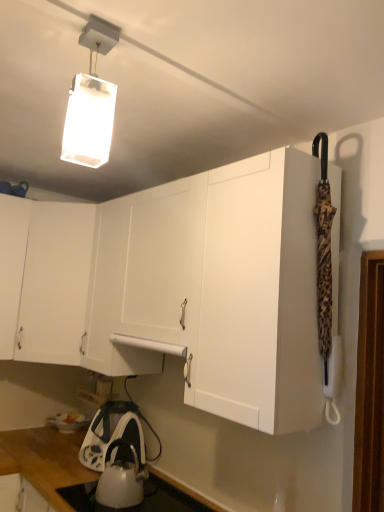
Question: From the image's perspective, is white matte cabinet at upper left located beneath white matte rectangular light fixture at upper center?

Choices:
 (A) no
 (B) yes

Answer: (B)

Question: Does white matte cabinet at upper left have a lesser height compared to white matte rectangular light fixture at upper center?

Choices:
 (A) yes
 (B) no

Answer: (B)

Question: Is white matte cabinet at upper left at the right side of white matte rectangular light fixture at upper center?

Choices:
 (A) no
 (B) yes

Answer: (A)

Question: Is white matte cabinet at upper left directly adjacent to white matte rectangular light fixture at upper center?

Choices:
 (A) yes
 (B) no

Answer: (B)

Question: From a real-world perspective, is white matte cabinet at upper left positioned over white matte rectangular light fixture at upper center based on gravity?

Choices:
 (A) no
 (B) yes

Answer: (A)

Question: Choose the correct answer: Is white matte rectangular light fixture at upper center inside white matte cabinet at upper left or outside it?

Choices:
 (A) outside
 (B) inside

Answer: (A)

Question: From a real-world perspective, is white matte rectangular light fixture at upper center physically located above or below white matte cabinet at upper left?

Choices:
 (A) below
 (B) above

Answer: (B)

Question: Is point (87, 157) positioned closer to the camera than point (49, 223)?

Choices:
 (A) farther
 (B) closer

Answer: (B)

Question: From the image's perspective, is white matte rectangular light fixture at upper center located above or below white matte cabinet at upper left?

Choices:
 (A) above
 (B) below

Answer: (A)

Question: Considering the positions of point (92, 233) and point (102, 501), is point (92, 233) closer or farther from the camera than point (102, 501)?

Choices:
 (A) farther
 (B) closer

Answer: (A)

Question: Considering the positions of white matte cabinet at upper left and white glossy kettle at lower center in the image, is white matte cabinet at upper left wider or thinner than white glossy kettle at lower center?

Choices:
 (A) wide
 (B) thin

Answer: (A)

Question: From their relative heights in the image, would you say white matte cabinet at upper left is taller or shorter than white glossy kettle at lower center?

Choices:
 (A) tall
 (B) short

Answer: (A)

Question: From the image's perspective, is white matte cabinet at upper left above or below white glossy kettle at lower center?

Choices:
 (A) above
 (B) below

Answer: (A)

Question: Looking at their shapes, would you say white glossy kettle at lower center is wider or thinner than white glossy kettle at lower center?

Choices:
 (A) thin
 (B) wide

Answer: (A)

Question: Would you say white glossy kettle at lower center is inside or outside white glossy kettle at lower center?

Choices:
 (A) outside
 (B) inside

Answer: (A)